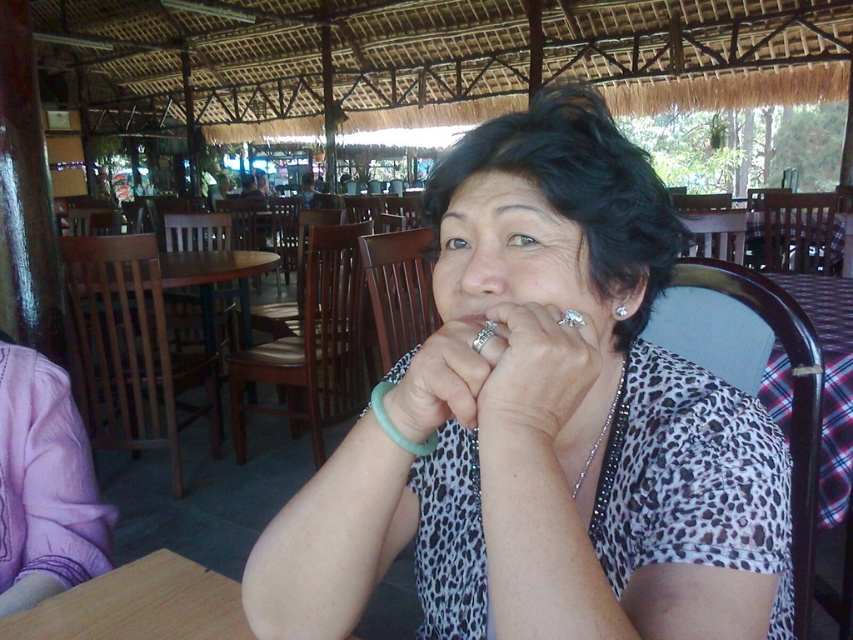
Who is positioned more to the left, silver metallic ring at center or brown wooden table at center?

brown wooden table at center

Is silver metallic ring at center bigger than brown wooden table at center?

No.

Find the location of a particular element. This screenshot has width=853, height=640. silver metallic ring at center is located at coordinates (534, 376).

Who is positioned more to the right, leopard print shirt at center or brown wooden table at center?

leopard print shirt at center

Measure the distance between point (x=450, y=404) and camera.

Point (x=450, y=404) and camera are 18.28 inches apart from each other.

The width and height of the screenshot is (853, 640). What are the coordinates of `leopard print shirt at center` in the screenshot? It's located at (444, 378).

Who is more distant from viewer, (569, 353) or (498, 330)?

Positioned behind is point (498, 330).

Between silver metallic ring at center and leopard print shirt at center, which one appears on the left side from the viewer's perspective?

leopard print shirt at center

Image resolution: width=853 pixels, height=640 pixels. What do you see at coordinates (534, 376) in the screenshot?
I see `silver metallic ring at center` at bounding box center [534, 376].

Find the location of a particular element. This screenshot has height=640, width=853. silver metallic ring at center is located at coordinates (534, 376).